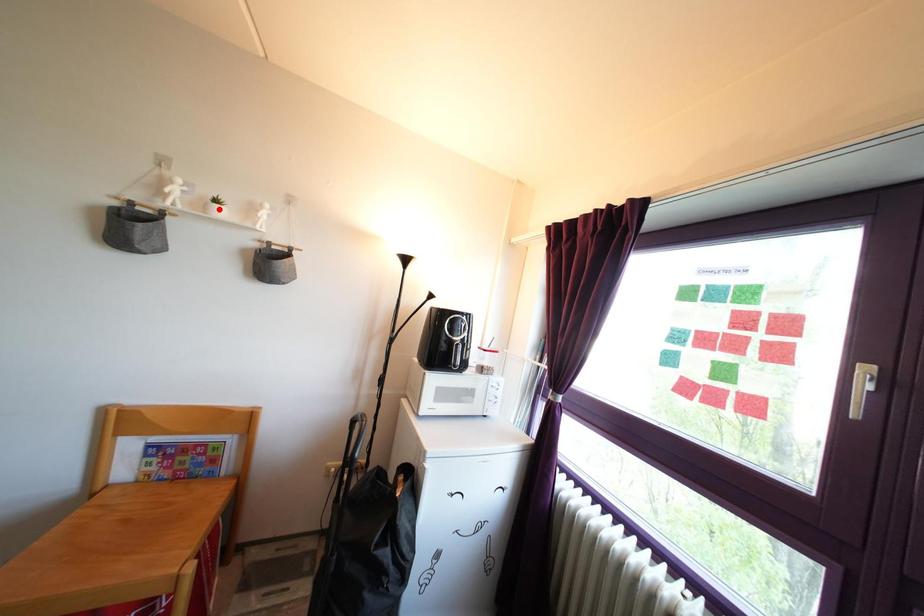
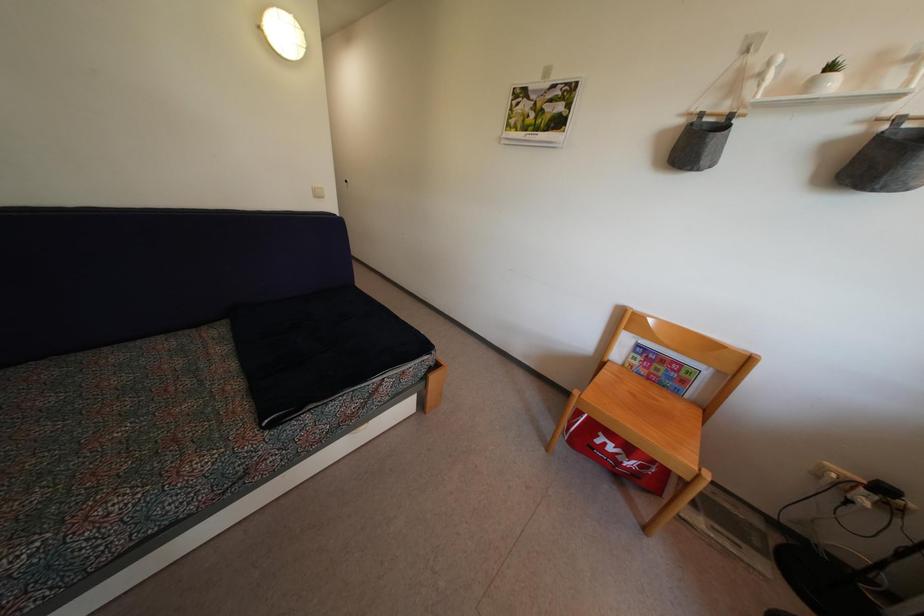
Question: I am providing you with two images of the same scene from different viewpoints. Image1 has a red point marked. In image2, the corresponding 3D location appears at what relative position? Reply with the corresponding letter.

Choices:
 (A) Closer
 (B) Farther

Answer: (B)